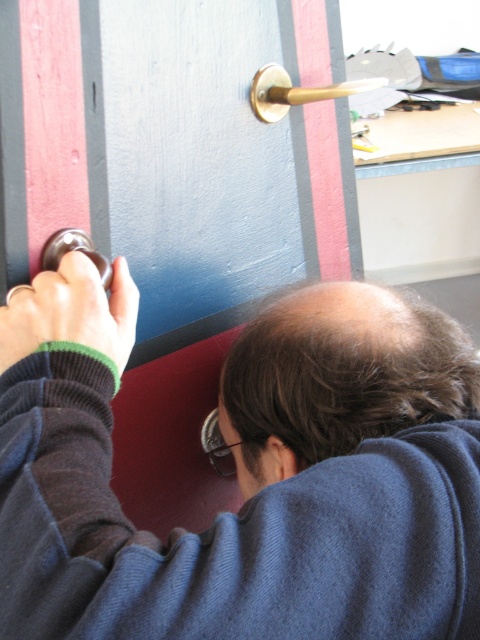
Question: Does dark blue sweater at center lie behind gold polished door handle at upper center?

Choices:
 (A) yes
 (B) no

Answer: (B)

Question: Which object appears farthest from the camera in this image?

Choices:
 (A) dark blue sweater at center
 (B) gold polished door handle at upper center
 (C) polished brass door handle at upper left

Answer: (B)

Question: Is dark blue sweater at center wider than polished brass door handle at upper left?

Choices:
 (A) no
 (B) yes

Answer: (B)

Question: Estimate the real-world distances between objects in this image. Which object is closer to the polished brass door handle at upper left?

Choices:
 (A) dark blue sweater at center
 (B) gold polished door handle at upper center
 (C) green knitted wristband at lower left

Answer: (C)

Question: Where is green knitted wristband at lower left located in relation to gold polished door handle at upper center in the image?

Choices:
 (A) left
 (B) right

Answer: (A)

Question: Which point is farther from the camera taking this photo?

Choices:
 (A) (410, 467)
 (B) (252, 81)

Answer: (B)